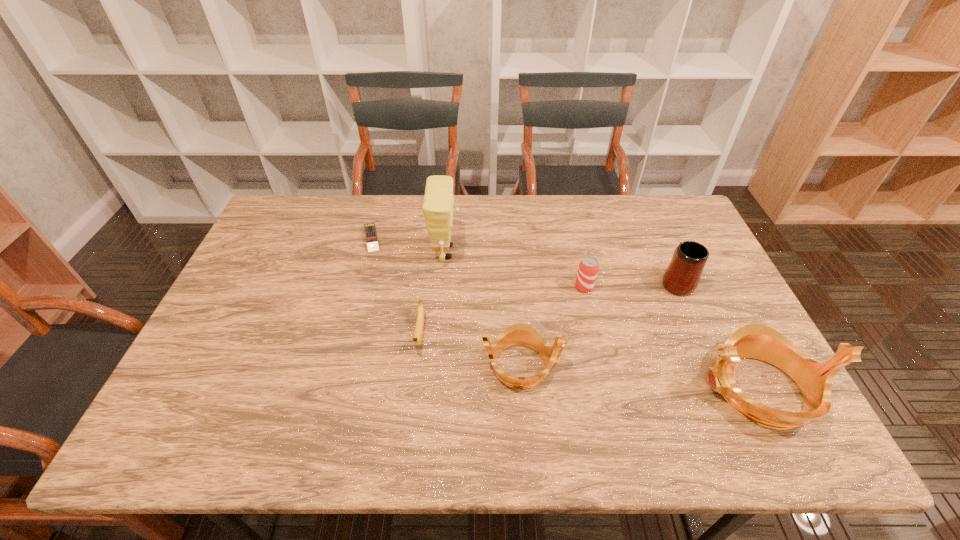
Where is `the left tiara`? the left tiara is located at coordinates (519, 334).

Identify the location of the fourth object from right to left. The height and width of the screenshot is (540, 960). (519, 334).

At what (x,y) coordinates should I click in order to perform the action: click on the sixth shortest object. Please return your answer as a coordinate pair (x, y). The height and width of the screenshot is (540, 960). Looking at the image, I should click on (757, 341).

Identify the location of the taller tiara. (757, 341).

Find the location of a particular element. mug is located at coordinates (682, 276).

Find the location of a particular element. This screenshot has height=540, width=960. the shortest object is located at coordinates (371, 237).

The width and height of the screenshot is (960, 540). Identify the location of remote control. (371, 237).

At what (x,y) coordinates should I click in order to perform the action: click on sponge. Please return your answer as a coordinate pair (x, y). Looking at the image, I should click on (437, 207).

You are a GUI agent. You are given a task and a screenshot of the screen. Output one action in this format:
    pyautogui.click(x=<x>, y=<y>)
    Task: Click on the fifth object from left to right
    The width and height of the screenshot is (960, 540).
    Given the screenshot: What is the action you would take?
    pyautogui.click(x=588, y=268)

Image resolution: width=960 pixels, height=540 pixels. I want to click on banana, so click(418, 334).